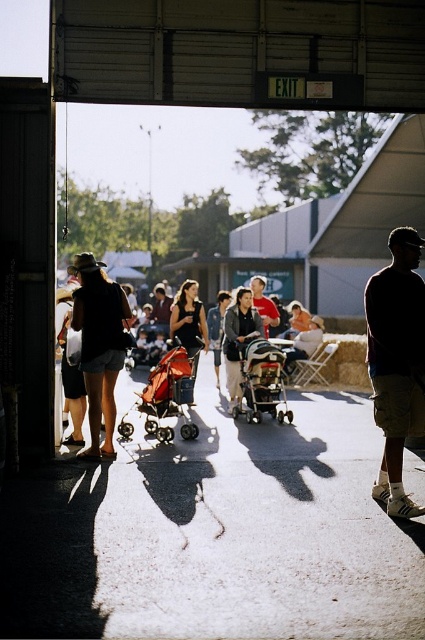
Question: Estimate the real-world distances between objects in this image. Which object is closer to the matte black shorts at center?

Choices:
 (A) silver metallic stroller at center
 (B) dark brown cargo shorts at right
 (C) matte black stroller at center

Answer: (A)

Question: Which of the following is the farthest from the observer?

Choices:
 (A) (99, 276)
 (B) (396, 369)

Answer: (A)

Question: Among these objects, which one is nearest to the camera?

Choices:
 (A) orange fabric stroller at center
 (B) matte red stroller at center
 (C) dark brown cargo shorts at right

Answer: (C)

Question: In this image, where is matte red stroller at center located relative to matte black shorts at center?

Choices:
 (A) right
 (B) left

Answer: (A)

Question: Can you confirm if matte black shorts at center is positioned below silver metallic stroller at center?

Choices:
 (A) no
 (B) yes

Answer: (A)

Question: Is dark brown cargo shorts at right closer to the viewer compared to matte red shirt at center?

Choices:
 (A) no
 (B) yes

Answer: (B)